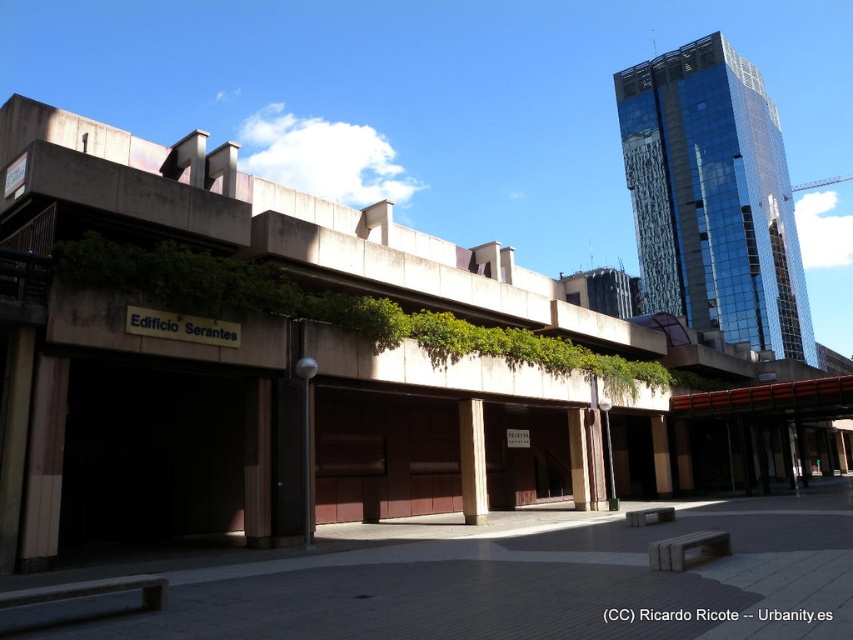
Question: Which object appears farthest from the camera in this image?

Choices:
 (A) smooth concrete pillar at center
 (B) glassy reflective skyscraper at upper right

Answer: (B)

Question: Does glassy reflective skyscraper at upper right have a lesser width compared to brown wood pillar at center?

Choices:
 (A) yes
 (B) no

Answer: (B)

Question: Which point is closer to the camera taking this photo?

Choices:
 (A) (569, 442)
 (B) (650, 138)

Answer: (A)

Question: Is smooth concrete pillar at center positioned behind brown wood pillar at center?

Choices:
 (A) no
 (B) yes

Answer: (A)

Question: Does glassy reflective skyscraper at upper right have a larger size compared to smooth concrete pillar at center?

Choices:
 (A) no
 (B) yes

Answer: (B)

Question: Which point appears closest to the camera in this image?

Choices:
 (A) (581, 438)
 (B) (722, 262)
 (C) (457, 435)

Answer: (A)